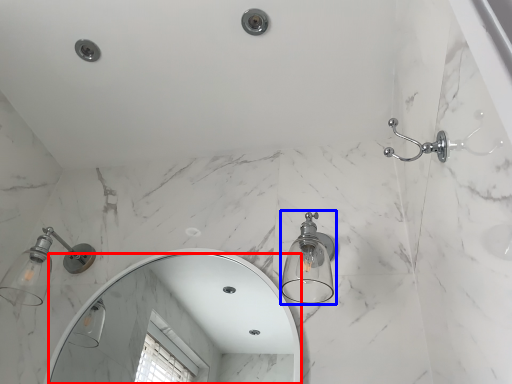
Question: Among these objects, which one is farthest to the camera, mirror (highlighted by a red box) or light fixture (highlighted by a blue box)?

Choices:
 (A) mirror
 (B) light fixture

Answer: (A)